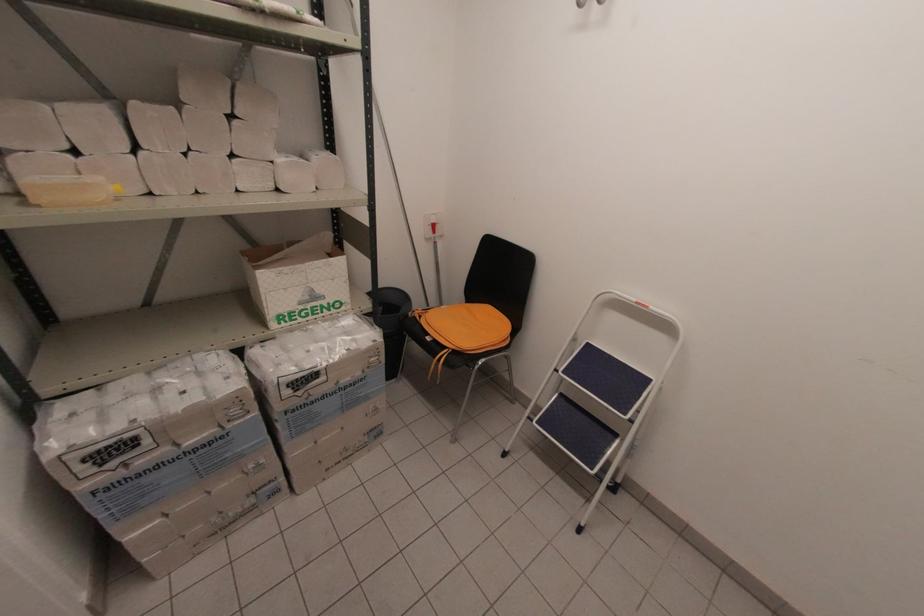
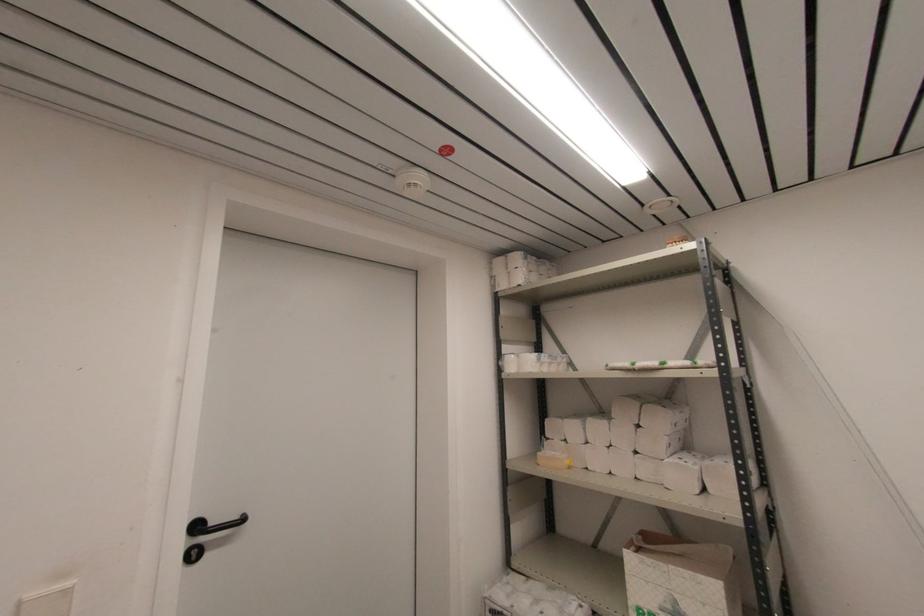
Locate, in the second image, the point that corresponds to point (40, 207) in the first image.

(540, 464)